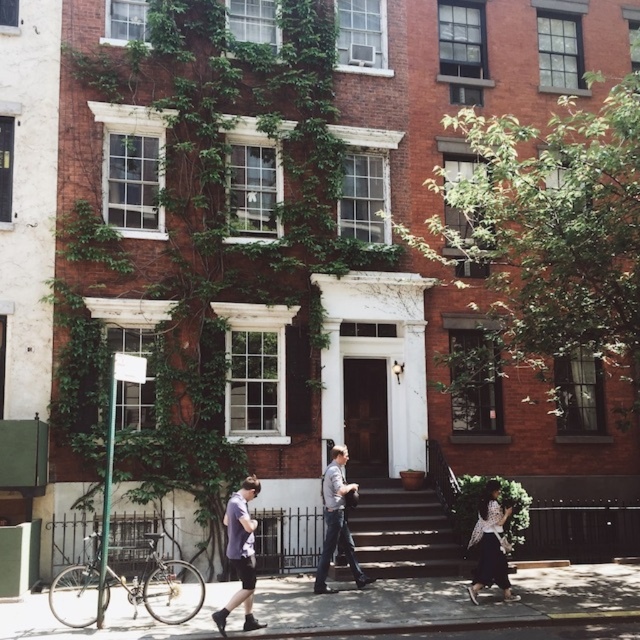
Does dark brown wooden stairs at center have a lesser width compared to dark purple t-shirt at lower left?

Incorrect, dark brown wooden stairs at center's width is not less than dark purple t-shirt at lower left's.

Between dark brown wooden stairs at center and dark purple t-shirt at lower left, which one appears on the left side from the viewer's perspective?

Positioned to the left is dark purple t-shirt at lower left.

What do you see at coordinates (401, 531) in the screenshot? I see `dark brown wooden stairs at center` at bounding box center [401, 531].

Where is `dark brown wooden stairs at center`? dark brown wooden stairs at center is located at coordinates (401, 531).

Does dark brown wooden stairs at center have a lesser width compared to black textured dress at lower right?

Incorrect, dark brown wooden stairs at center's width is not less than black textured dress at lower right's.

Locate an element on the screen. The image size is (640, 640). dark brown wooden stairs at center is located at coordinates (401, 531).

Where is `dark brown wooden stairs at center`? This screenshot has width=640, height=640. dark brown wooden stairs at center is located at coordinates (401, 531).

Does dark brown wooden stairs at center have a lesser height compared to light gray shirt at center?

Yes.

Is point (412, 564) less distant than point (324, 502)?

No.

At what (x,y) coordinates should I click in order to perform the action: click on dark brown wooden stairs at center. Please return your answer as a coordinate pair (x, y). The height and width of the screenshot is (640, 640). Looking at the image, I should click on (401, 531).